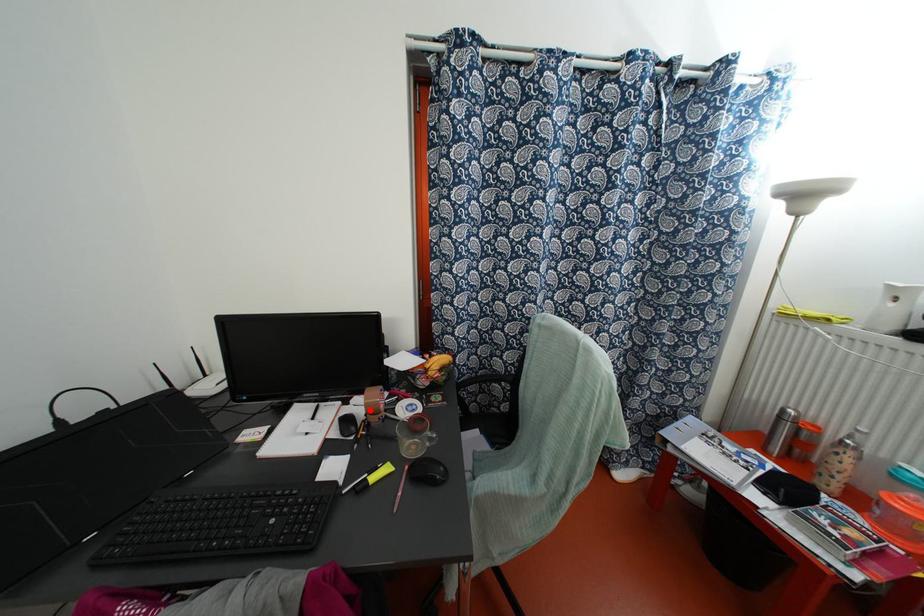
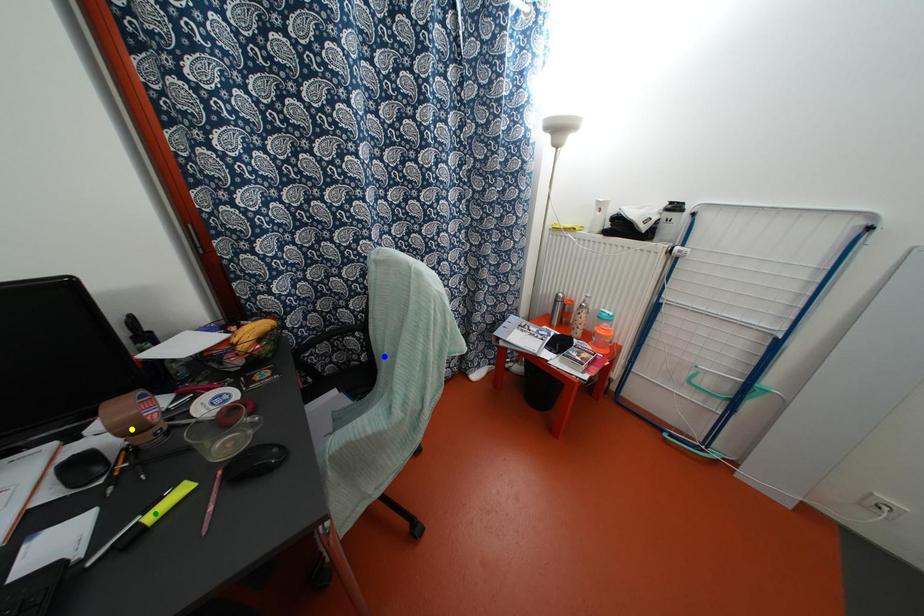
Question: I am providing you with two images of the same scene from different viewpoints. A red point is marked on the first image. You are given multiple points on the second image. Which point in image 2 is actually the same real-world point as the red point in image 1?

Choices:
 (A) green point
 (B) blue point
 (C) yellow point

Answer: (C)